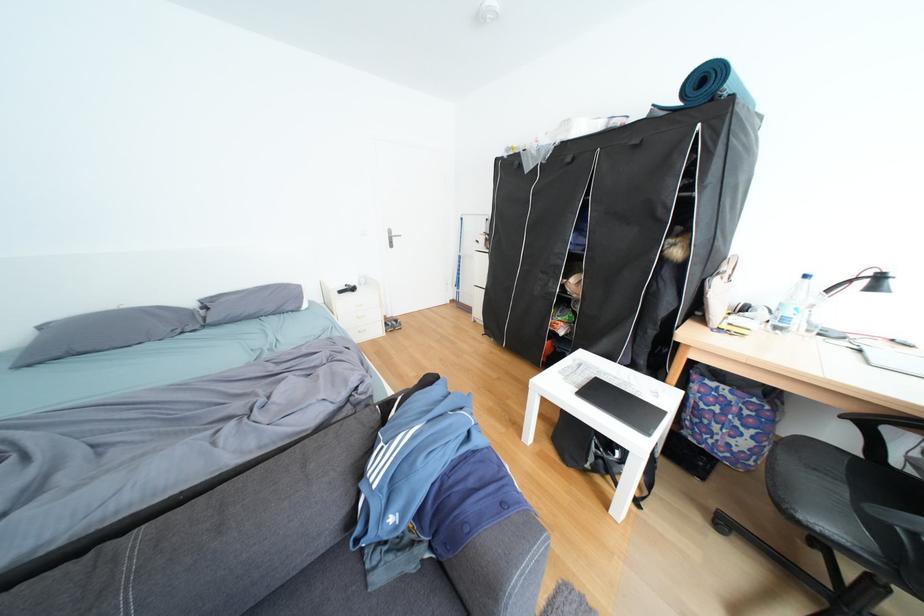
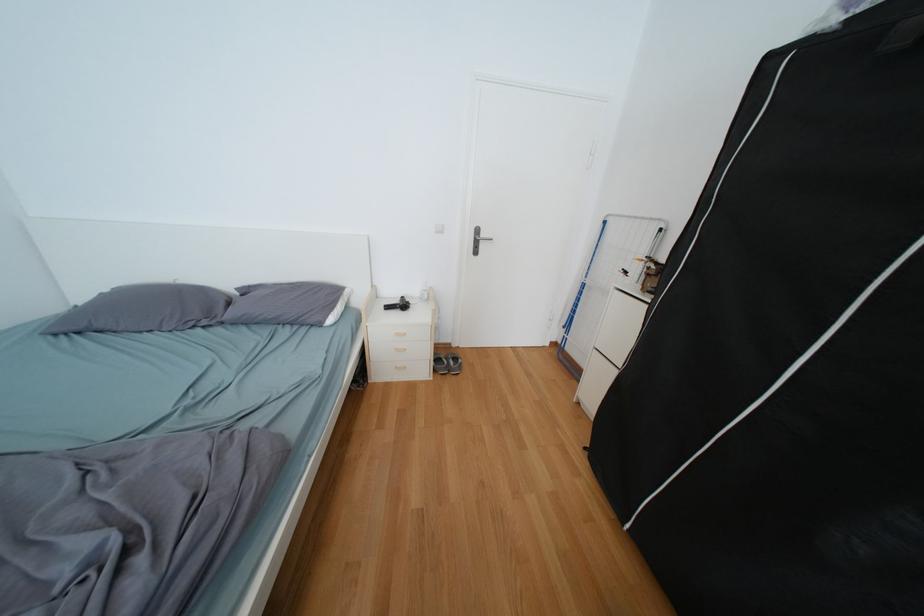
In the second image, find the point that corresponds to point 190,331 in the first image.

(204, 323)